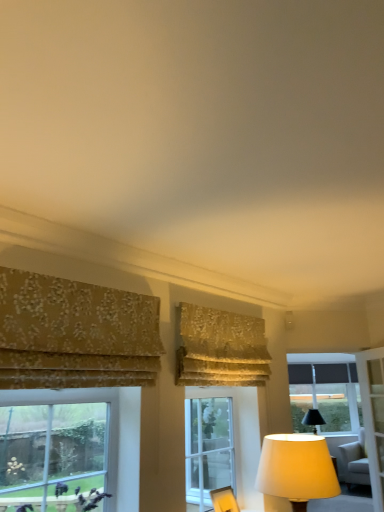
Question: Is floral fabric curtain at upper center, which ranks as the 2th curtain in left-to-right order, facing away from clear glass window at center, the second window viewed from the left?

Choices:
 (A) yes
 (B) no

Answer: (B)

Question: Can you confirm if floral fabric curtain at upper center, placed as the 1th curtain when sorted from back to front, is thinner than clear glass window at center, which is the 2th window in top-to-bottom order?

Choices:
 (A) no
 (B) yes

Answer: (A)

Question: Can you confirm if floral fabric curtain at upper center, acting as the first curtain starting from the right, is taller than clear glass window at center, which is the 2th window in top-to-bottom order?

Choices:
 (A) no
 (B) yes

Answer: (A)

Question: Is floral fabric curtain at upper center, acting as the first curtain starting from the right, aimed at clear glass window at center, which appears as the second window when viewed from the front?

Choices:
 (A) no
 (B) yes

Answer: (A)

Question: From a real-world perspective, is floral fabric curtain at upper center, which is counted as the second curtain, starting from the front, beneath clear glass window at center, acting as the second window starting from the right?

Choices:
 (A) yes
 (B) no

Answer: (B)

Question: Is floral fabric curtain at upper center, acting as the first curtain starting from the right, not within clear glass window at center, which is the 2th window in top-to-bottom order?

Choices:
 (A) no
 (B) yes

Answer: (B)

Question: Can you see clear glass window at lower left, which is the 1th window in left-to-right order, touching gold floral fabric curtain at left, placed as the second curtain when sorted from back to front?

Choices:
 (A) no
 (B) yes

Answer: (A)

Question: Can you confirm if clear glass window at lower left, marked as the 3th window in a right-to-left arrangement, is positioned to the left of gold floral fabric curtain at left, placed as the second curtain when sorted from back to front?

Choices:
 (A) yes
 (B) no

Answer: (A)

Question: Is clear glass window at lower left, placed as the first window when sorted from front to back, positioned before gold floral fabric curtain at left, the second curtain in the right-to-left sequence?

Choices:
 (A) no
 (B) yes

Answer: (A)

Question: Considering the relative sizes of clear glass window at lower left, marked as the 3th window in a right-to-left arrangement, and gold floral fabric curtain at left, acting as the 1th curtain starting from the front, in the image provided, is clear glass window at lower left, marked as the 3th window in a right-to-left arrangement, thinner than gold floral fabric curtain at left, acting as the 1th curtain starting from the front,?

Choices:
 (A) yes
 (B) no

Answer: (B)

Question: Does clear glass window at lower left, the third window when ordered from back to front, have a smaller size compared to gold floral fabric curtain at left, positioned as the first curtain in left-to-right order?

Choices:
 (A) no
 (B) yes

Answer: (B)

Question: Is clear glass window at lower left, which is the 1th window in top-to-bottom order, further to camera compared to gold floral fabric curtain at left, the second curtain in the right-to-left sequence?

Choices:
 (A) yes
 (B) no

Answer: (A)

Question: From a real-world perspective, is clear glass window at lower left, marked as the 3th window in a right-to-left arrangement, on top of clear glass window at upper right?

Choices:
 (A) no
 (B) yes

Answer: (B)